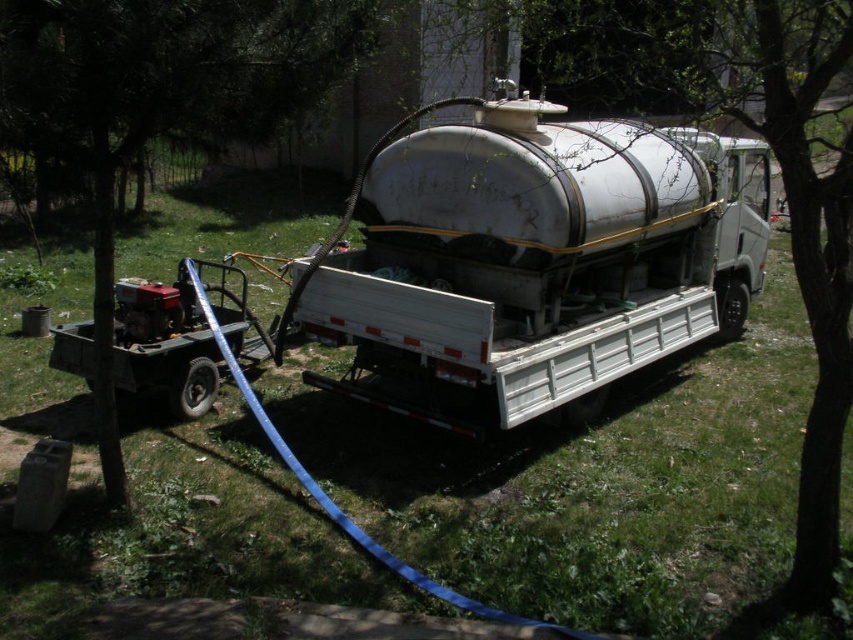
You are standing at the edge of the grassy area and want to walk towards the green leafy tree at upper right. Which direction should you walk to avoid stepping on the green grass at center?

To reach the green leafy tree at upper right without stepping on the green grass at center, you should walk to the right side of the green leafy tree at upper right since the green grass at center is located to its left.

You are standing at the point closest to the tanker truck. Which of the two points, point (537, 176) or point (260, 52), is farther away from you?

Point (537, 176) is behind point (260, 52), so it is farther away from you.

You are a delivery driver who needs to park your truck on the grassy area. The green grass at center is to the left of the white matte tanker truck at center. Which direction should you move your truck to avoid driving over the grass?

Move your truck to the right side of the white matte tanker truck at center to avoid the green grass at center which is on its left.